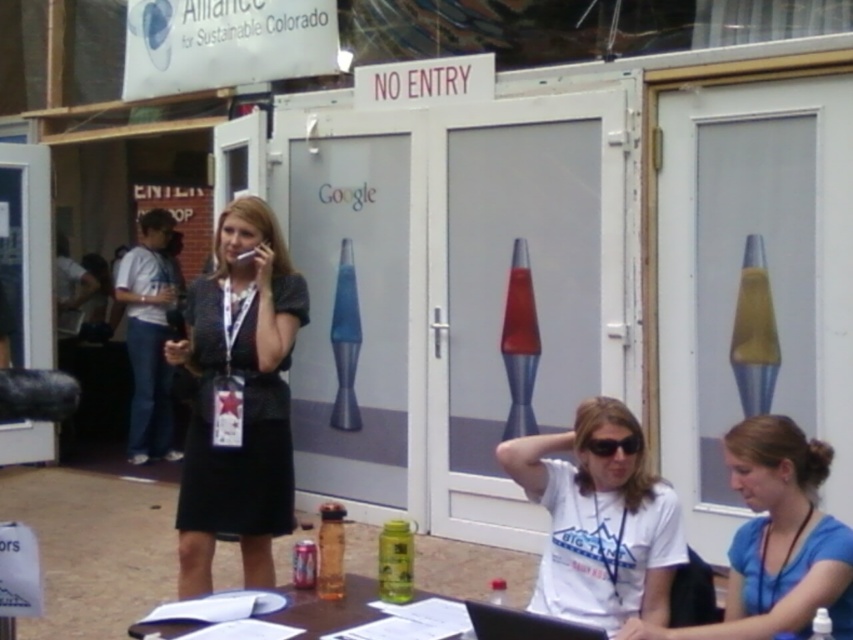
Question: Which object appears farthest from the camera in this image?

Choices:
 (A) black fabric dress at center
 (B) black plastic sunglasses at center
 (C) black plastic laptop at lower center
 (D) white matte shirt at center

Answer: (A)

Question: Which of these objects is positioned closest to the white matte shirt at center?

Choices:
 (A) black plastic sunglasses at center
 (B) black plastic laptop at lower center
 (C) black fabric dress at center

Answer: (A)

Question: Which of the following is the farthest from the observer?

Choices:
 (A) white matte shirt at center
 (B) white matte shirt at lower center

Answer: (A)

Question: Considering the relative positions of black fabric dress at center and white matte shirt at center in the image provided, where is black fabric dress at center located with respect to white matte shirt at center?

Choices:
 (A) right
 (B) left

Answer: (B)

Question: Does black fabric dress at center have a lesser width compared to white matte shirt at center?

Choices:
 (A) yes
 (B) no

Answer: (A)

Question: Can you confirm if white matte shirt at center is thinner than black plastic laptop at lower center?

Choices:
 (A) no
 (B) yes

Answer: (A)